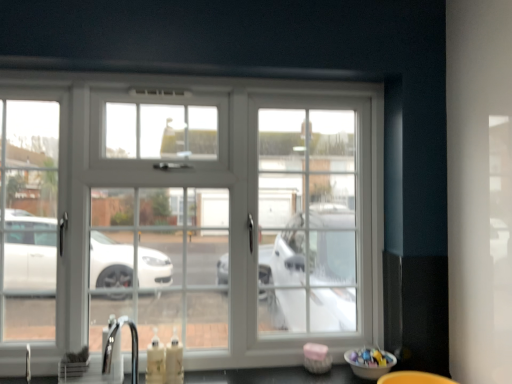
Question: Is satin nickel faucet at lower left bigger or smaller than white glossy window at center?

Choices:
 (A) big
 (B) small

Answer: (B)

Question: In the image, is satin nickel faucet at lower left on the left side or the right side of white glossy window at center?

Choices:
 (A) left
 (B) right

Answer: (A)

Question: From their relative heights in the image, would you say satin nickel faucet at lower left is taller or shorter than white glossy window at center?

Choices:
 (A) short
 (B) tall

Answer: (A)

Question: Is white glossy window at center in front of or behind satin nickel faucet at lower left in the image?

Choices:
 (A) behind
 (B) front

Answer: (A)

Question: In terms of height, does white glossy window at center look taller or shorter compared to satin nickel faucet at lower left?

Choices:
 (A) short
 (B) tall

Answer: (B)

Question: Would you say white glossy window at center is to the left or to the right of satin nickel faucet at lower left in the picture?

Choices:
 (A) right
 (B) left

Answer: (A)

Question: Considering the positions of white glossy window at center and satin nickel faucet at lower left in the image, is white glossy window at center wider or thinner than satin nickel faucet at lower left?

Choices:
 (A) thin
 (B) wide

Answer: (B)